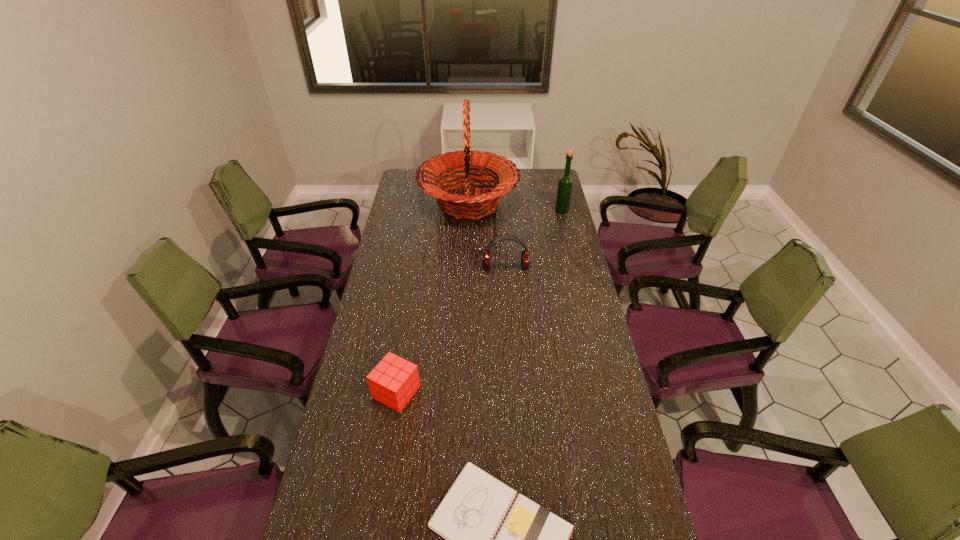
Find the location of a particular element. The image size is (960, 540). blank space located 0.270m on the right of the fourth tallest object is located at coordinates coord(509,392).

The image size is (960, 540). What are the coordinates of `object that is positioned at the far edge` in the screenshot? It's located at (480, 201).

Where is `basket located at the left edge`? This screenshot has width=960, height=540. basket located at the left edge is located at coordinates (480, 201).

Find the location of `cube that is positioned at the left edge`. cube that is positioned at the left edge is located at coordinates (393, 382).

Identify the location of object positioned at the right edge. The width and height of the screenshot is (960, 540). (565, 183).

Find the location of `object that is positioned at the far left corner`. object that is positioned at the far left corner is located at coordinates (480, 201).

I want to click on vacant space at the far edge, so click(x=517, y=184).

At what (x,y) coordinates should I click in order to perform the action: click on free space at the left edge of the desktop. Please return your answer as a coordinate pair (x, y). Looking at the image, I should click on (410, 198).

This screenshot has width=960, height=540. I want to click on vacant space at the right edge of the desktop, so coord(598,497).

You are a GUI agent. You are given a task and a screenshot of the screen. Output one action in this format:
    pyautogui.click(x=<x>, y=<y>)
    Task: Click on the vacant space at the far right corner of the desktop
    This screenshot has width=960, height=540.
    Given the screenshot: What is the action you would take?
    pyautogui.click(x=539, y=176)